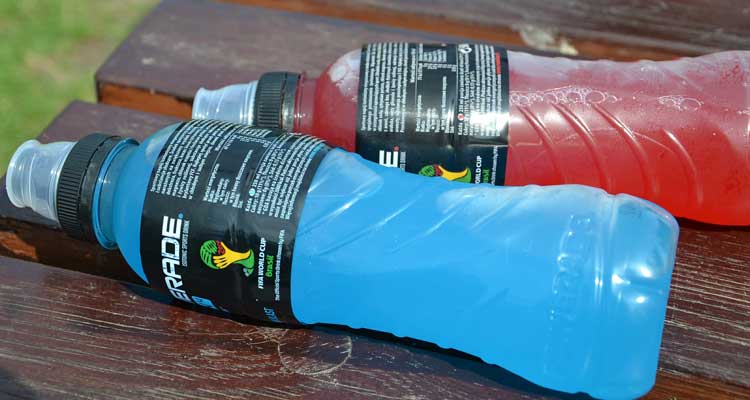
This screenshot has height=400, width=750. What are the coordinates of `wooden bench` in the screenshot? It's located at (292, 46).